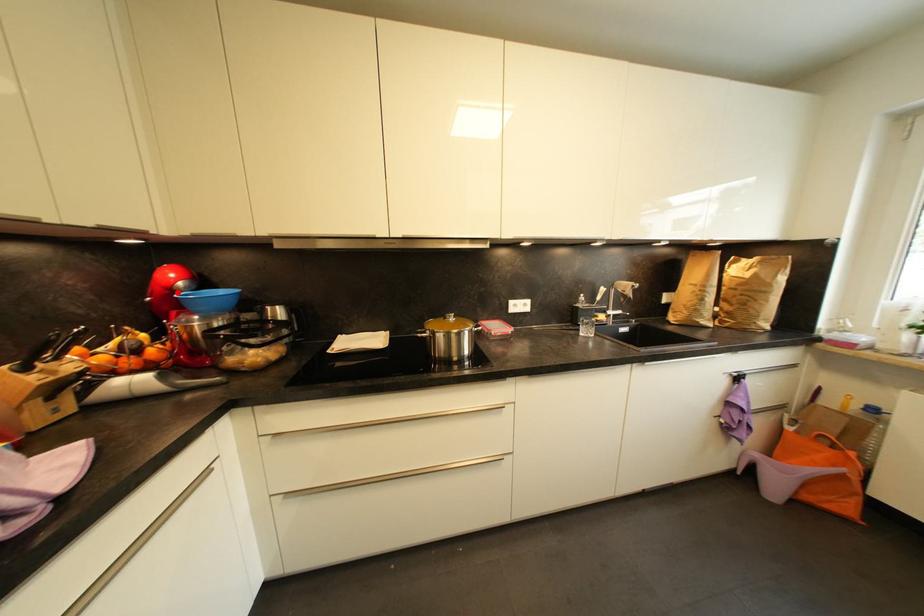
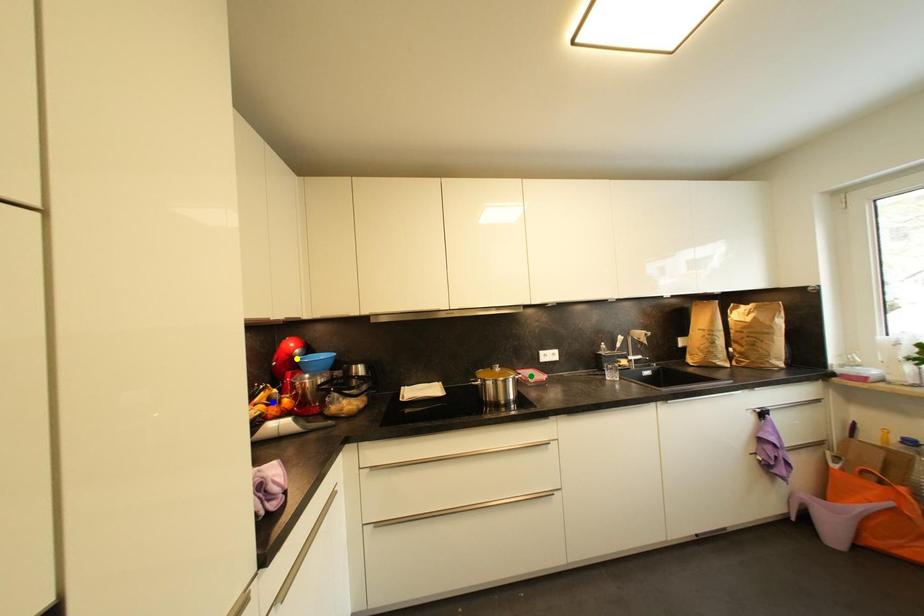
Question: I am providing you with two images of the same scene from different viewpoints. A red point is marked on the first image. You are given multiple points on the second image. Which point in image 2 is actually the same real-world point as the red point in image 1?

Choices:
 (A) green point
 (B) blue point
 (C) yellow point

Answer: (C)